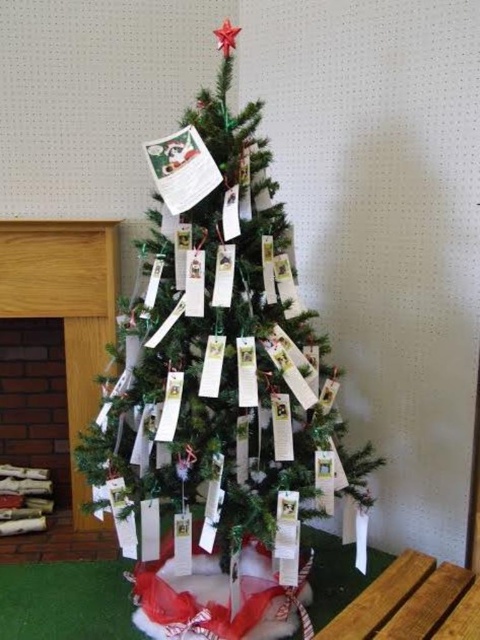
You are standing in front of the Christmas tree and want to place a new decoration behind the green matte christmas tree at center so it can be seen through the branches. Is the white paper card at center currently blocking your view where you want to place it?

The green matte christmas tree at center is in front of the white paper card at center, so the tree is blocking the view of the card. Therefore, placing a decoration behind the tree would not be blocked by the white paper card at center since the tree is in front of it.

You are a child trying to reach the white paper card at center hanging on the green matte christmas tree at center. The tree is 1.5 meters tall. If you can reach up to 1.2 meters, will you be able to touch the card?

The green matte christmas tree at center is taller than the white paper card at center. Since the tree is 1.5 meters tall, the card must be shorter than that. However, since you can only reach up to 1.2 meters, you might not be able to touch the card if it is placed higher than your reach on the tree.

What are the coordinates of the green matte Christmas tree at center?

The green matte Christmas tree at center is located at point (226, 355).